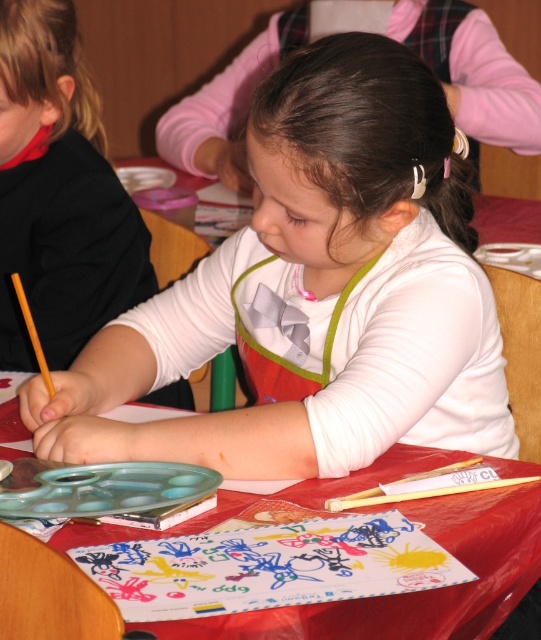
Question: Is white matte apron at center closer to camera compared to matte white shirt at center?

Choices:
 (A) no
 (B) yes

Answer: (B)

Question: Based on their relative distances, which object is nearer to the white matte apron at center?

Choices:
 (A) matte white shirt at center
 (B) red plastic table at center

Answer: (B)

Question: Does white matte apron at center have a smaller size compared to matte white shirt at center?

Choices:
 (A) yes
 (B) no

Answer: (B)

Question: Among these objects, which one is nearest to the camera?

Choices:
 (A) matte white shirt at center
 (B) red plastic table at center

Answer: (B)

Question: Can you confirm if white matte apron at center is bigger than matte white shirt at center?

Choices:
 (A) no
 (B) yes

Answer: (B)

Question: Which point is closer to the camera?

Choices:
 (A) matte white shirt at center
 (B) white matte apron at center
 (C) red plastic table at center

Answer: (C)